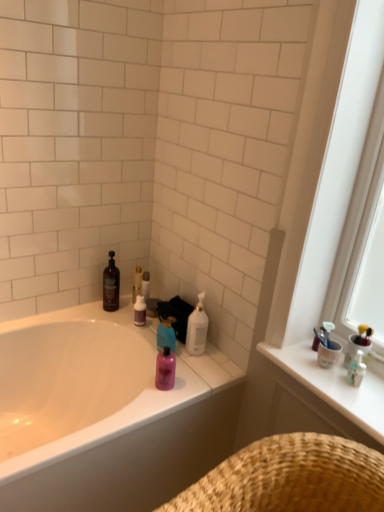
This screenshot has height=512, width=384. Identify the location of free point in front of matte black bottle at upper left, marked as the first cleaning product in a left-to-right arrangement. (107, 325).